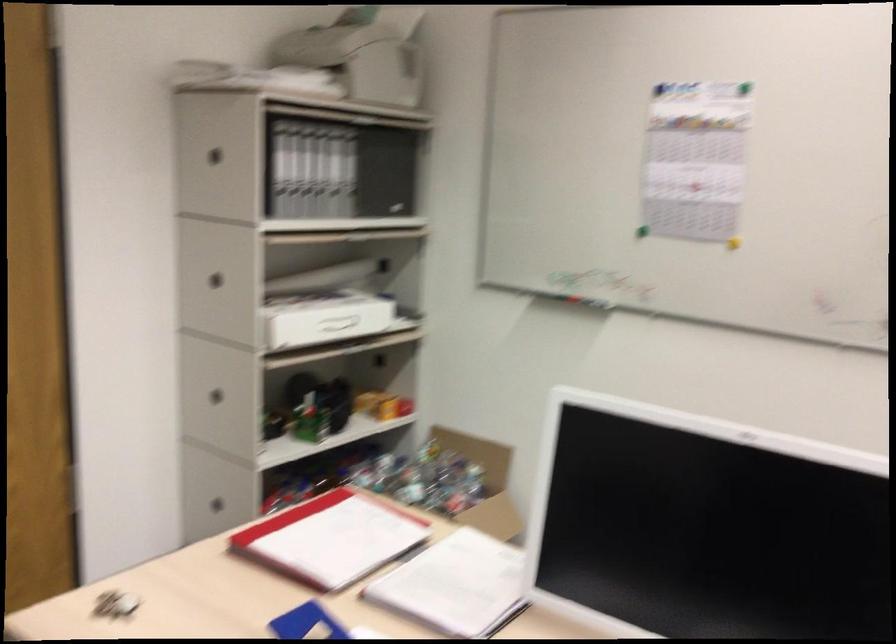
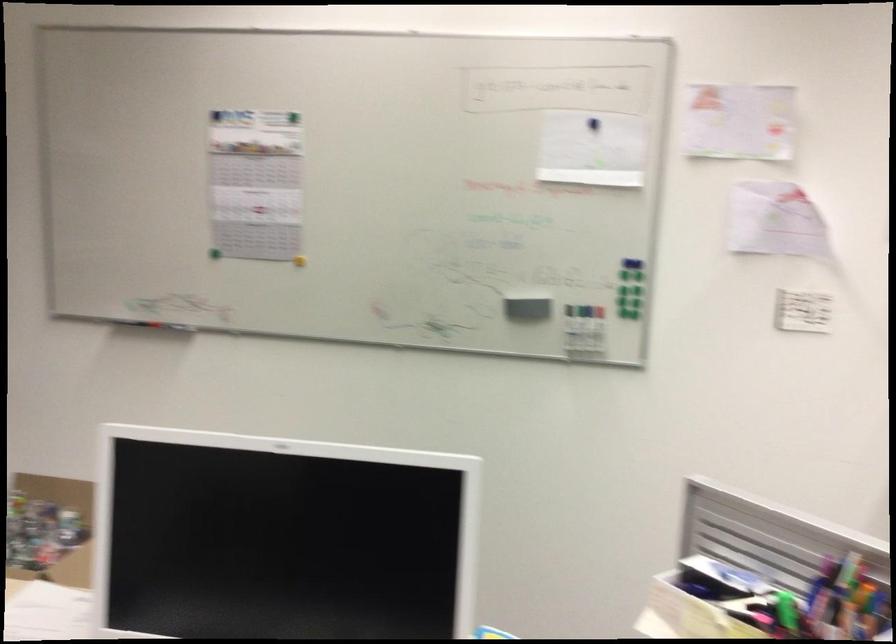
The point at [653,82] is marked in the first image. Where is the corresponding point in the second image?

(216, 116)